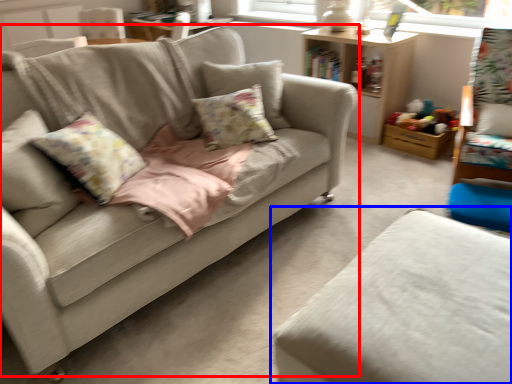
Question: Which object appears farthest to the camera in this image, studio couch (highlighted by a red box) or studio couch (highlighted by a blue box)?

Choices:
 (A) studio couch
 (B) studio couch

Answer: (A)